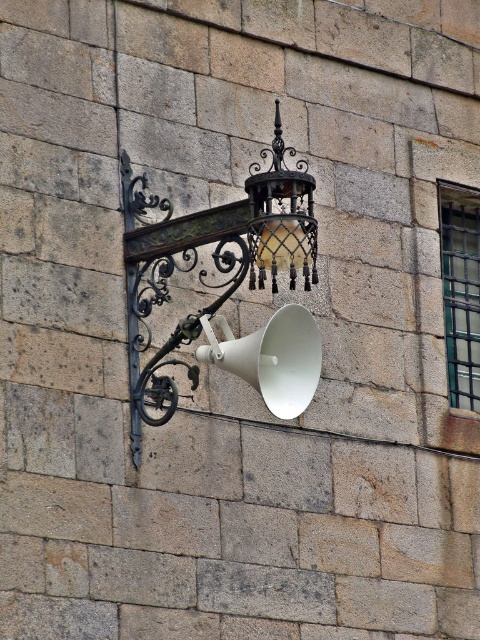
Is white matte megaphone at center taller than matte black lantern at upper center?

No, white matte megaphone at center is not taller than matte black lantern at upper center.

Looking at this image, can you confirm if white matte megaphone at center is bigger than matte black lantern at upper center?

Incorrect, white matte megaphone at center is not larger than matte black lantern at upper center.

Is point (312, 384) less distant than point (310, 289)?

That is True.

Image resolution: width=480 pixels, height=640 pixels. In order to click on white matte megaphone at center in this screenshot , I will do `click(272, 356)`.

Who is shorter, matte black lantern at center or white matte megaphone at center?

white matte megaphone at center is shorter.

Is matte black lantern at center wider than white matte megaphone at center?

Correct, the width of matte black lantern at center exceeds that of white matte megaphone at center.

I want to click on matte black lantern at center, so click(229, 289).

Find the location of `matte black lantern at center`. matte black lantern at center is located at coordinates (229, 289).

Who is more distant from viewer, (269,227) or (251,180)?

The point (251,180) is more distant.

At what (x,y) coordinates should I click in order to perform the action: click on matte black lantern at center. Please return your answer as a coordinate pair (x, y). This screenshot has width=480, height=640. Looking at the image, I should click on (229, 289).